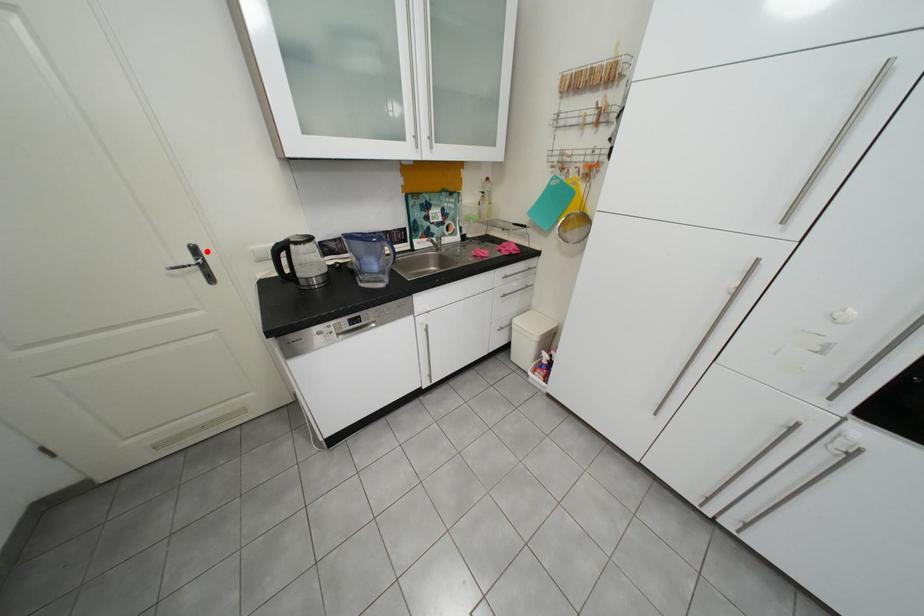
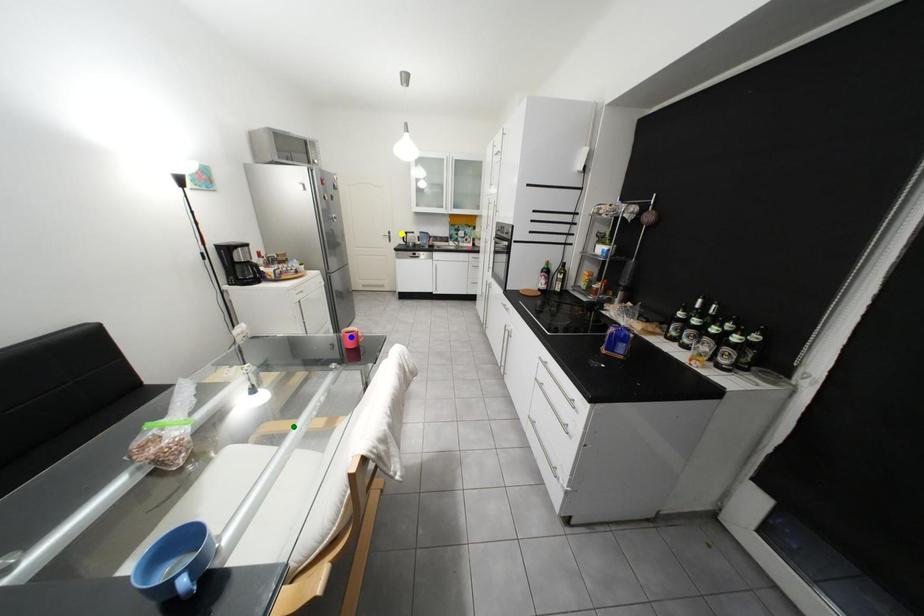
Question: I am providing you with two images of the same scene from different viewpoints. A red point is marked on the first image. You are given multiple points on the second image. In image 2, which mark is for the same physical point as the one in image 1?

Choices:
 (A) yellow point
 (B) blue point
 (C) green point

Answer: (A)